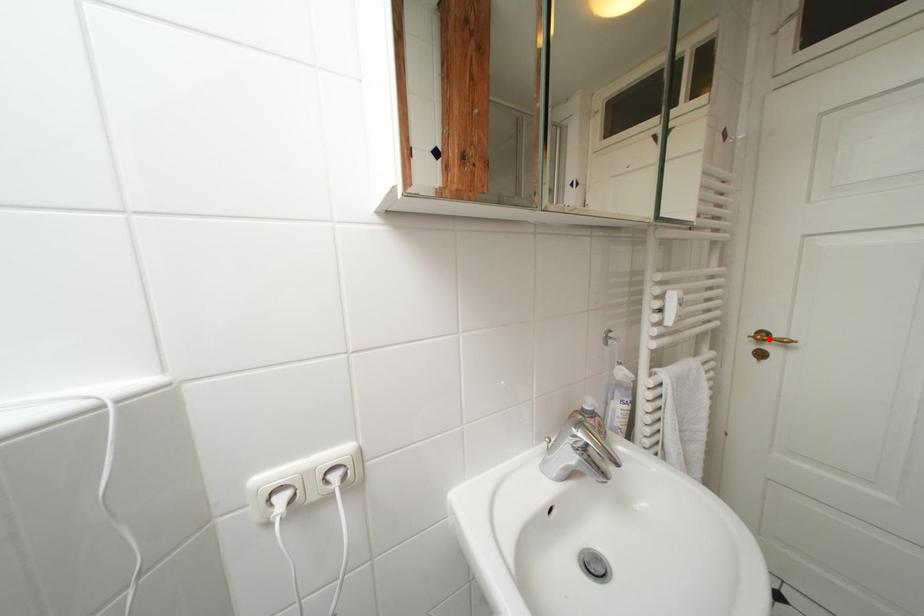
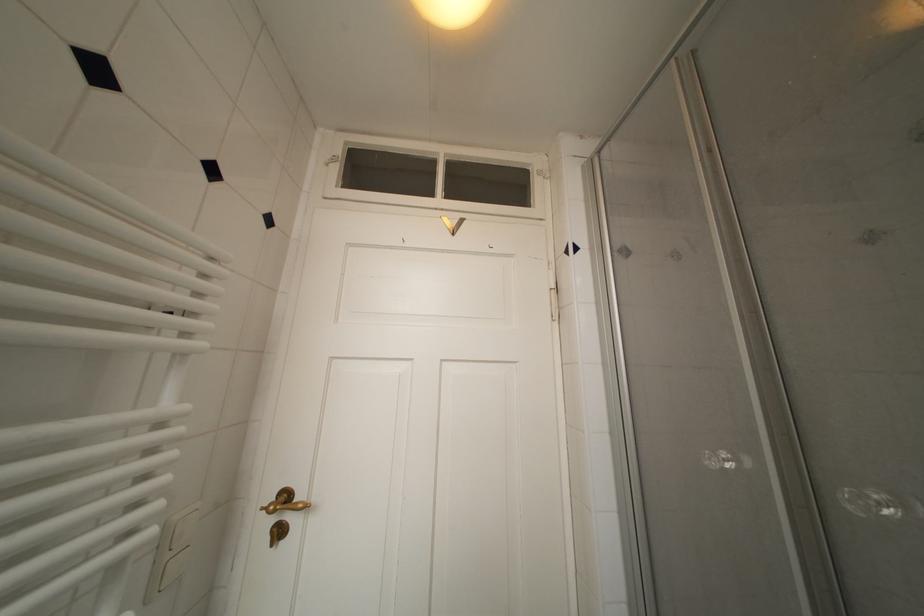
In the second image, find the point that corresponds to the highlighted location in the first image.

(293, 500)